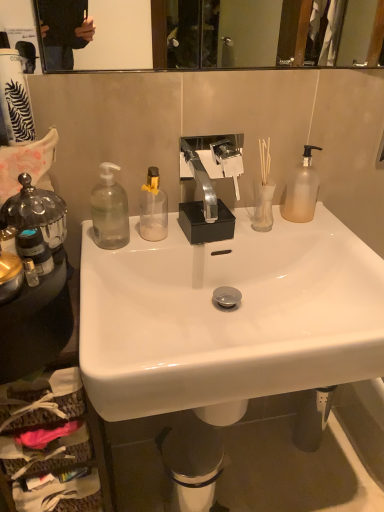
Question: Is white glossy sink at center inside the boundaries of translucent glass vase at center, or outside?

Choices:
 (A) outside
 (B) inside

Answer: (A)

Question: Is white glossy sink at center in front of or behind translucent glass vase at center in the image?

Choices:
 (A) front
 (B) behind

Answer: (A)

Question: Estimate the real-world distances between objects in this image. Which object is closer to the transparent plastic soap dispenser at left, marked as the 1th bottle in a left-to-right arrangement?

Choices:
 (A) translucent glass vase at center
 (B) frosted glass pump bottle at upper right, which ranks as the 1th bottle in right-to-left order
 (C) transparent glass bottle at center, the second bottle in the left-to-right sequence
 (D) metallic trash bin at lower center
 (E) white matte toilet paper at upper left

Answer: (C)

Question: Which is nearer to the translucent glass vase at center?

Choices:
 (A) frosted glass pump bottle at upper right, the 3th bottle from the left
 (B) white matte toilet paper at upper left
 (C) metallic trash bin at lower center
 (D) white glossy sink at center
 (E) transparent plastic soap dispenser at left, the third bottle in the right-to-left sequence

Answer: (A)